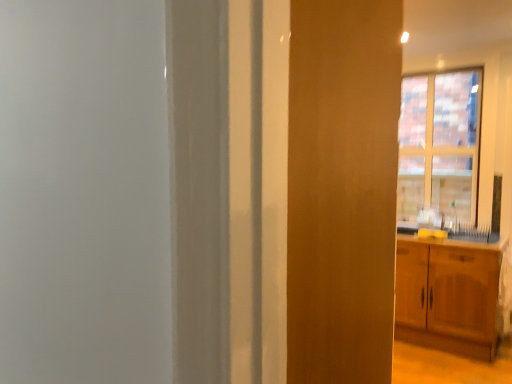
This screenshot has height=384, width=512. What do you see at coordinates (440, 145) in the screenshot?
I see `brick textured window at upper right` at bounding box center [440, 145].

Find the location of a particular element. The width and height of the screenshot is (512, 384). brick textured window at upper right is located at coordinates (440, 145).

The width and height of the screenshot is (512, 384). What do you see at coordinates (448, 295) in the screenshot?
I see `wooden cabinet at right` at bounding box center [448, 295].

Identify the location of wooden cabinet at right. (448, 295).

Find the location of a particular element. brick textured window at upper right is located at coordinates (440, 145).

Visually, is wooden cabinet at right positioned to the left or to the right of brick textured window at upper right?

wooden cabinet at right is to the left of brick textured window at upper right.

Which object is further away from the camera, wooden cabinet at right or brick textured window at upper right?

brick textured window at upper right is behind.

Does point (446, 348) come behind point (450, 119)?

No, it is not.

From the image's perspective, which is above, wooden cabinet at right or brick textured window at upper right?

brick textured window at upper right, from the image's perspective.

From a real-world perspective, which object stands above the other?

brick textured window at upper right, from a real-world perspective.

Considering the sizes of wooden cabinet at right and brick textured window at upper right in the image, is wooden cabinet at right wider or thinner than brick textured window at upper right?

Clearly, wooden cabinet at right has more width compared to brick textured window at upper right.

Is wooden cabinet at right taller than brick textured window at upper right?

Incorrect, the height of wooden cabinet at right is not larger of that of brick textured window at upper right.

Can you confirm if wooden cabinet at right is bigger than brick textured window at upper right?

Correct, wooden cabinet at right is larger in size than brick textured window at upper right.

Does wooden cabinet at right contain brick textured window at upper right?

No, wooden cabinet at right does not contain brick textured window at upper right.

Is wooden cabinet at right next to brick textured window at upper right and touching it?

No, wooden cabinet at right is not touching brick textured window at upper right.

In the scene shown: Does wooden cabinet at right turn towards brick textured window at upper right?

No, wooden cabinet at right is not oriented towards brick textured window at upper right.

I want to click on cabinetry below the brick textured window at upper right (from the image's perspective), so click(448, 295).

Is brick textured window at upper right to the left of wooden cabinet at right from the viewer's perspective?

No, brick textured window at upper right is not to the left of wooden cabinet at right.

In the image, is brick textured window at upper right positioned in front of or behind wooden cabinet at right?

In the image, brick textured window at upper right appears behind wooden cabinet at right.

Between point (475, 223) and point (498, 244), which one is positioned behind?

The point (475, 223) is more distant.

From the image's perspective, which one is positioned higher, brick textured window at upper right or wooden cabinet at right?

brick textured window at upper right appears higher in the image.

From a real-world perspective, is brick textured window at upper right above or below wooden cabinet at right?

From a real-world perspective, brick textured window at upper right is physically above wooden cabinet at right.

Considering the sizes of objects brick textured window at upper right and wooden cabinet at right in the image provided, who is thinner, brick textured window at upper right or wooden cabinet at right?

Thinner between the two is brick textured window at upper right.

Is brick textured window at upper right taller than wooden cabinet at right?

Yes.

In terms of size, does brick textured window at upper right appear bigger or smaller than wooden cabinet at right?

brick textured window at upper right is smaller than wooden cabinet at right.

Is brick textured window at upper right completely or partially outside of wooden cabinet at right?

Indeed, brick textured window at upper right is completely outside wooden cabinet at right.

Is brick textured window at upper right touching wooden cabinet at right?

→ No.

Could you tell me if brick textured window at upper right is turned towards wooden cabinet at right?

No, brick textured window at upper right is not turned towards wooden cabinet at right.

Looking at this image, what's the angular difference between brick textured window at upper right and wooden cabinet at right's facing directions?

brick textured window at upper right and wooden cabinet at right are facing 0.00196 degrees away from each other.

Locate an element on the screen. This screenshot has width=512, height=384. cabinetry that appears below the brick textured window at upper right (from a real-world perspective) is located at coordinates (448, 295).

Find the location of a particular element. The width and height of the screenshot is (512, 384). cabinetry below the brick textured window at upper right (from the image's perspective) is located at coordinates tap(448, 295).

What are the coordinates of `cabinetry on the left of brick textured window at upper right` in the screenshot? It's located at [x=448, y=295].